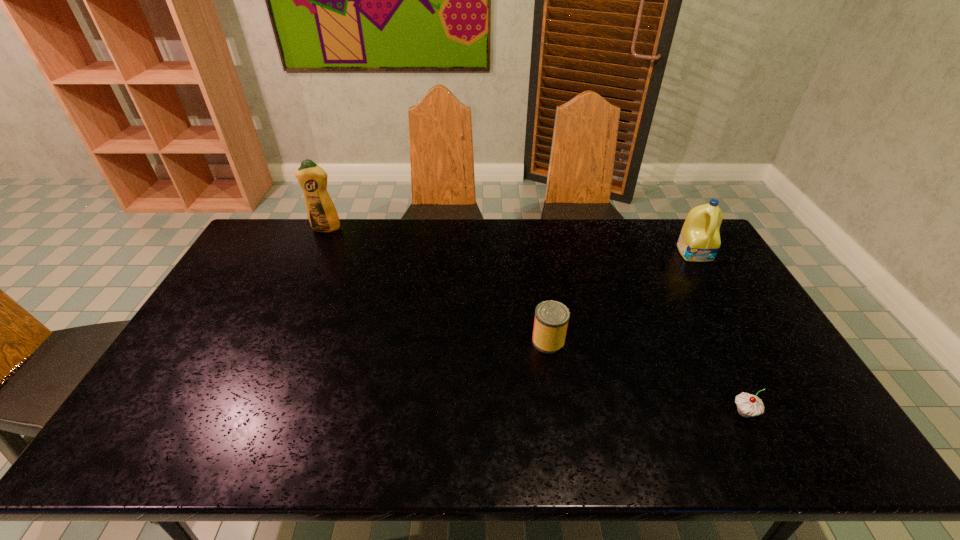
Locate an element on the screen. empty location between the second shortest object and the shortest object is located at coordinates point(646,376).

I want to click on free spot between the second object from left to right and the farther detergent, so click(437, 285).

You are a GUI agent. You are given a task and a screenshot of the screen. Output one action in this format:
    pyautogui.click(x=<x>, y=<y>)
    Task: Click on the vacant area between the second tallest object and the cupcake
    The width and height of the screenshot is (960, 540).
    Given the screenshot: What is the action you would take?
    pyautogui.click(x=720, y=333)

Find the location of a particular element. The height and width of the screenshot is (540, 960). vacant area between the nearest object and the rightmost object is located at coordinates (720, 333).

You are a GUI agent. You are given a task and a screenshot of the screen. Output one action in this format:
    pyautogui.click(x=<x>, y=<y>)
    Task: Click on the free point between the third nearest object and the cupcake
    
    Given the screenshot: What is the action you would take?
    pyautogui.click(x=720, y=333)

Locate which object ranks second in proximity to the second object from right to left. Please provide its 2D coordinates. Your answer should be formatted as a tuple, i.e. [(x, y)], where the tuple contains the x and y coordinates of a point satisfying the conditions above.

[(699, 241)]

Select which object is the closest to the can. Please provide its 2D coordinates. Your answer should be formatted as a tuple, i.e. [(x, y)], where the tuple contains the x and y coordinates of a point satisfying the conditions above.

[(748, 405)]

You are a GUI agent. You are given a task and a screenshot of the screen. Output one action in this format:
    pyautogui.click(x=<x>, y=<y>)
    Task: Click on the free space that satisfies the following two spatial constraints: 1. on the label of the tallest object; 2. on the left side of the second shortest object
    
    Given the screenshot: What is the action you would take?
    (275, 341)

Find the location of a particular element. vacant space that satisfies the following two spatial constraints: 1. on the label of the shortest object; 2. on the left side of the tallest object is located at coordinates (242, 413).

Identify the location of vacant space that satisfies the following two spatial constraints: 1. on the label of the third tallest object; 2. on the left side of the leftmost object. (275, 341).